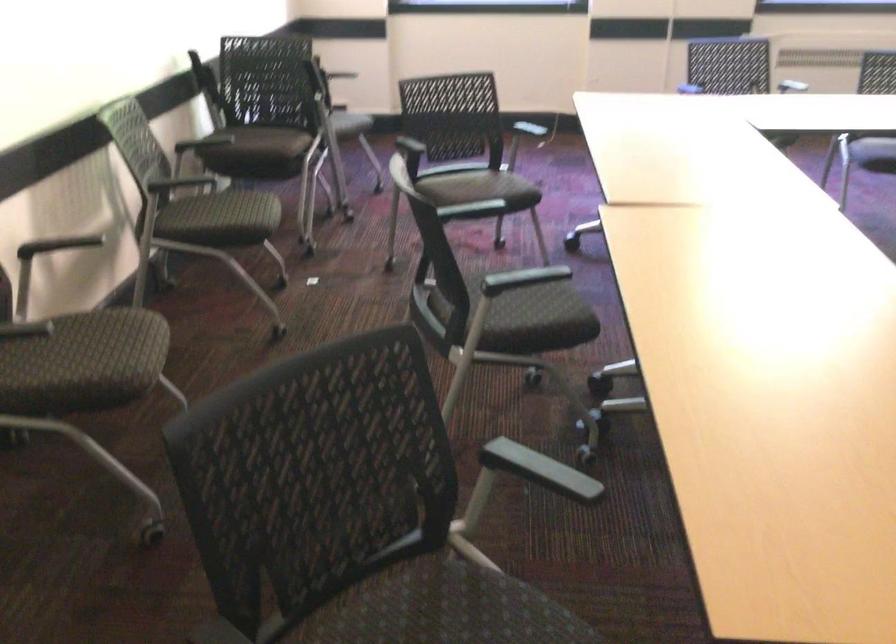
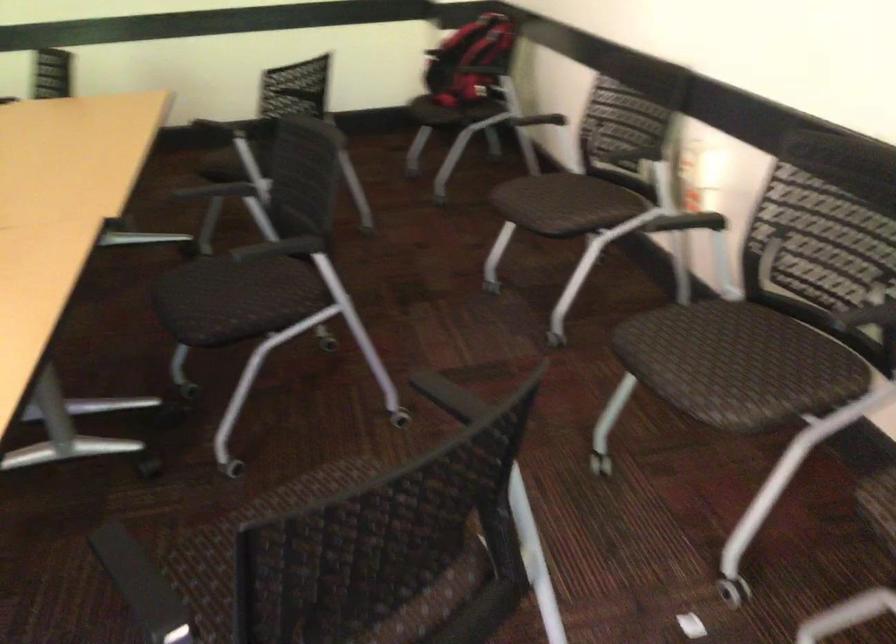
Find the pixel in the second image that matches (527,295) in the first image.

(222, 301)